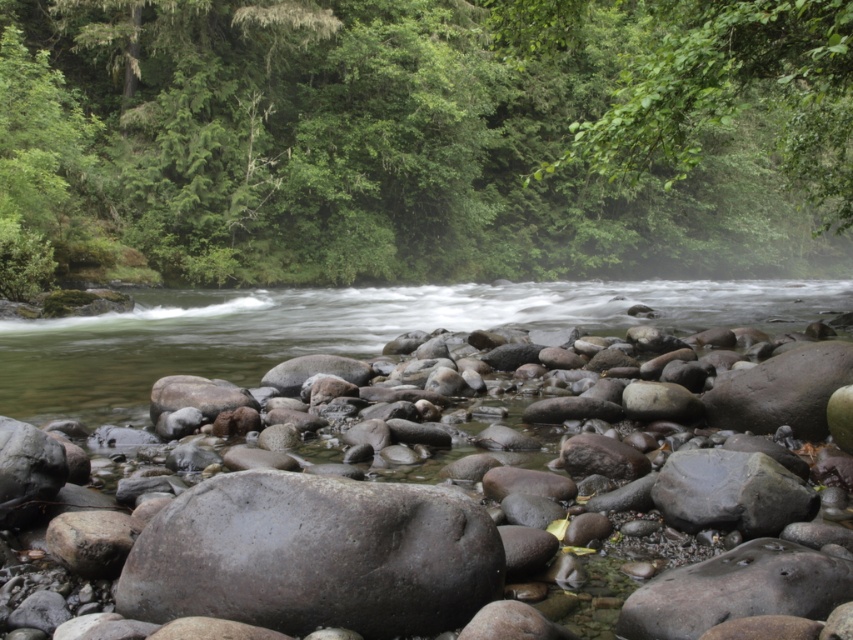
Question: Observing the image, what is the correct spatial positioning of gray matte rock at center in reference to gray smooth rock at center?

Choices:
 (A) below
 (B) above

Answer: (A)

Question: Is green leafy tree at upper center bigger than gray smooth rock at center?

Choices:
 (A) no
 (B) yes

Answer: (B)

Question: Considering the real-world distances, which object is farthest from the gray smooth rock at center?

Choices:
 (A) gray matte rock at center
 (B) green leafy tree at upper center

Answer: (B)

Question: Can you confirm if green leafy tree at upper center is positioned to the left of gray matte rock at center?

Choices:
 (A) yes
 (B) no

Answer: (B)

Question: Which of these objects is positioned closest to the green leafy tree at upper center?

Choices:
 (A) gray matte rock at center
 (B) gray smooth rock at center

Answer: (A)

Question: Based on their relative distances, which object is farther from the gray smooth rock at center?

Choices:
 (A) green leafy tree at upper center
 (B) gray matte rock at center

Answer: (A)